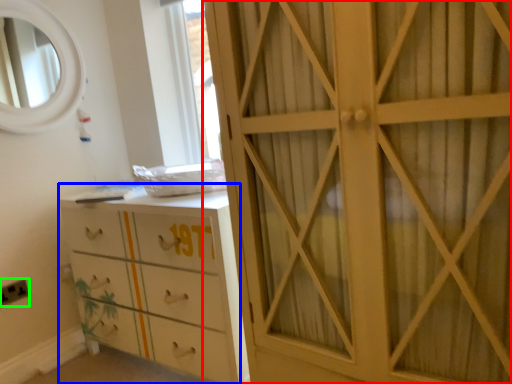
Question: Estimate the real-world distances between objects in this image. Which object is farther from cupboard (highlighted by a red box), chest of drawers (highlighted by a blue box) or electric outlet (highlighted by a green box)?

Choices:
 (A) chest of drawers
 (B) electric outlet

Answer: (B)